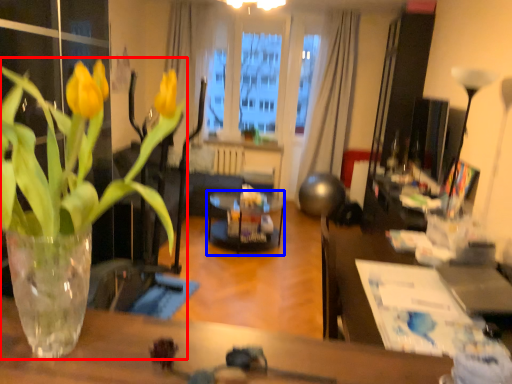
Question: Among these objects, which one is nearest to the camera, houseplant (highlighted by a red box) or glass table (highlighted by a blue box)?

Choices:
 (A) houseplant
 (B) glass table

Answer: (A)